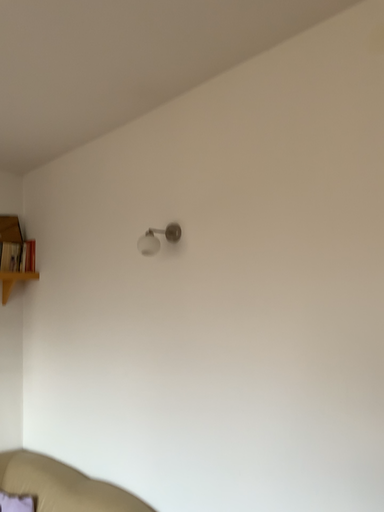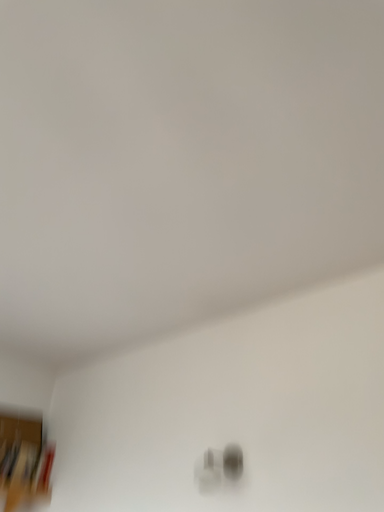
Question: Which way did the camera rotate in the video?

Choices:
 (A) rotated downward
 (B) rotated upward

Answer: (B)